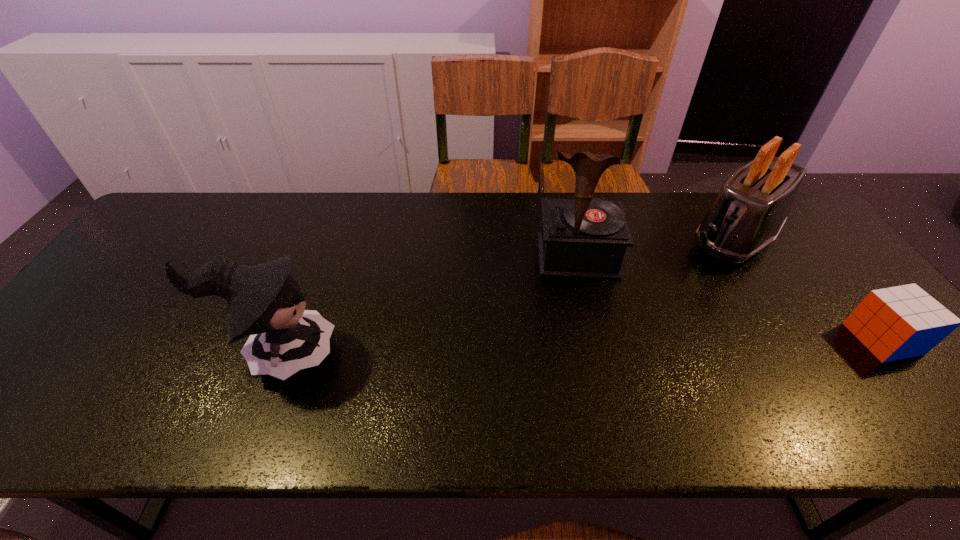
Find the location of a particular element. The height and width of the screenshot is (540, 960). vacant space at the far edge of the desktop is located at coordinates (368, 206).

Where is `free space at the near edge of the desktop`? This screenshot has width=960, height=540. free space at the near edge of the desktop is located at coordinates 158,372.

Locate an element on the screen. Image resolution: width=960 pixels, height=540 pixels. free location at the left edge of the desktop is located at coordinates (188, 242).

Where is `free location at the far left corner of the desktop`? free location at the far left corner of the desktop is located at coordinates (214, 210).

Locate an element on the screen. The width and height of the screenshot is (960, 540). vacant area at the far right corner is located at coordinates (802, 219).

You are a GUI agent. You are given a task and a screenshot of the screen. Output one action in this format:
    pyautogui.click(x=<x>, y=<y>)
    Task: Click on the vacant space that is in between the cube and the second object from left to right
    The height and width of the screenshot is (540, 960).
    Given the screenshot: What is the action you would take?
    pyautogui.click(x=730, y=298)

Find the location of a particular element. free spot between the third object from right to left and the doll is located at coordinates (428, 305).

Identify the location of vacant space in between the doll and the second object from left to right. The image size is (960, 540). (428, 305).

This screenshot has width=960, height=540. I want to click on vacant area that lies between the leftmost object and the cube, so click(x=581, y=346).

This screenshot has width=960, height=540. What are the coordinates of `free space between the leftmost object and the toaster` in the screenshot? It's located at (506, 296).